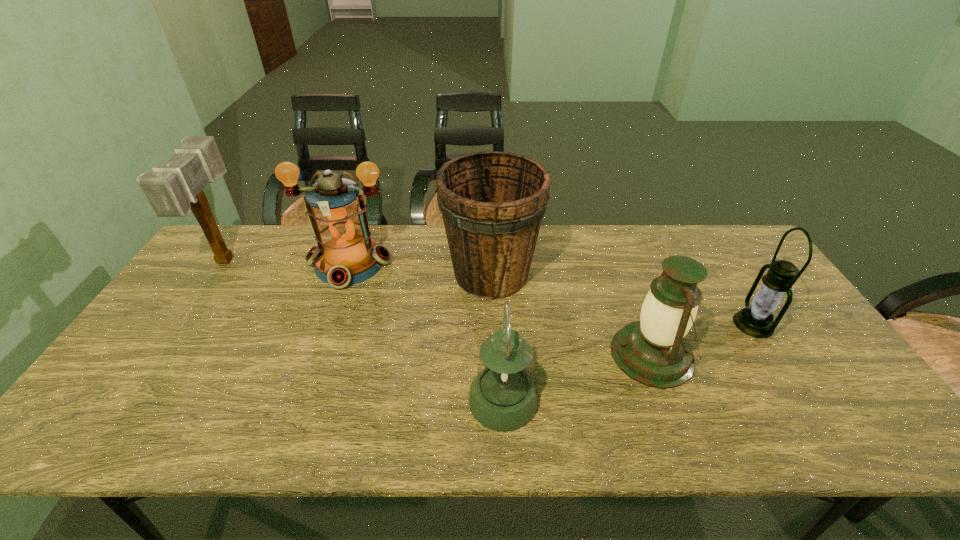
I want to click on vacant space located on the side where the rightmost object emits light, so click(x=680, y=324).

This screenshot has height=540, width=960. I want to click on vacant space positioned on the side where the rightmost object emits light, so click(658, 324).

Locate an element on the screen. The width and height of the screenshot is (960, 540). vacant region located on the side where the rightmost object emits light is located at coordinates click(x=658, y=324).

The width and height of the screenshot is (960, 540). I want to click on vacant space located 0.110m with the light compartment facing forward on the second lantern from right to left, so click(x=568, y=355).

This screenshot has height=540, width=960. In order to click on vacant region located with the light compartment facing forward on the second lantern from right to left in this screenshot , I will do `click(568, 355)`.

Where is `vacant point located with the light compartment facing forward on the second lantern from right to left`? vacant point located with the light compartment facing forward on the second lantern from right to left is located at coordinates (541, 355).

At what (x,y) coordinates should I click in order to perform the action: click on free space located on the back of the third lantern from right to left. Please return your answer as a coordinate pair (x, y). Looking at the image, I should click on (500, 327).

At what (x,y) coordinates should I click in order to perform the action: click on mallet situated at the far edge. Please return your answer as a coordinate pair (x, y). Image resolution: width=960 pixels, height=540 pixels. Looking at the image, I should click on (174, 189).

The width and height of the screenshot is (960, 540). Find the location of `lantern that is at the far edge`. lantern that is at the far edge is located at coordinates (345, 255).

Where is `bucket that is at the far edge`? bucket that is at the far edge is located at coordinates (492, 203).